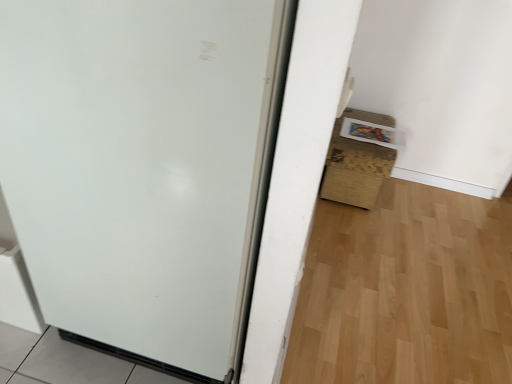
Question: From the image's perspective, would you say brown cardboard box at lower right is positioned over white matte door at center?

Choices:
 (A) yes
 (B) no

Answer: (A)

Question: Does brown cardboard box at lower right have a larger size compared to white matte door at center?

Choices:
 (A) yes
 (B) no

Answer: (B)

Question: From a real-world perspective, is brown cardboard box at lower right on top of white matte door at center?

Choices:
 (A) yes
 (B) no

Answer: (B)

Question: Is brown cardboard box at lower right with white matte door at center?

Choices:
 (A) no
 (B) yes

Answer: (A)

Question: Is brown cardboard box at lower right to the right of white matte door at center from the viewer's perspective?

Choices:
 (A) yes
 (B) no

Answer: (A)

Question: Is brown cardboard box at lower right wider than white matte door at center?

Choices:
 (A) no
 (B) yes

Answer: (A)

Question: Is white matte door at center facing towards brown cardboard box at lower right?

Choices:
 (A) yes
 (B) no

Answer: (B)

Question: Is white matte door at center at the right side of brown cardboard box at lower right?

Choices:
 (A) yes
 (B) no

Answer: (B)

Question: Can you confirm if white matte door at center is taller than brown cardboard box at lower right?

Choices:
 (A) no
 (B) yes

Answer: (B)

Question: Is white matte door at center positioned with its back to brown cardboard box at lower right?

Choices:
 (A) yes
 (B) no

Answer: (B)

Question: Is white matte door at center closer to camera compared to brown cardboard box at lower right?

Choices:
 (A) no
 (B) yes

Answer: (B)

Question: Could brown cardboard box at lower right be considered to be inside white matte door at center?

Choices:
 (A) no
 (B) yes

Answer: (A)

Question: From their relative heights in the image, would you say brown cardboard box at lower right is taller or shorter than white matte door at center?

Choices:
 (A) tall
 (B) short

Answer: (B)